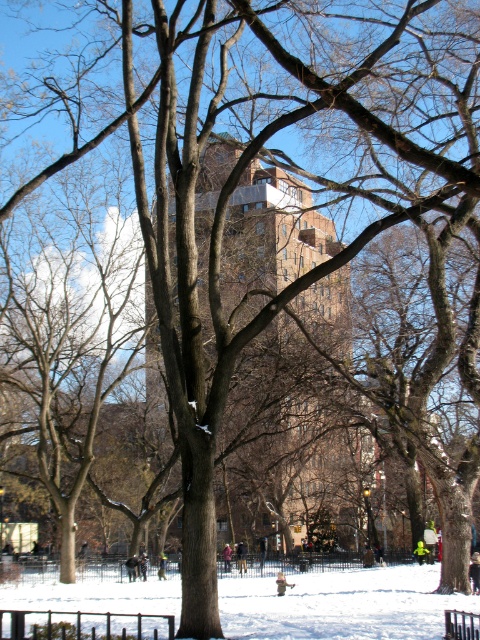
Question: Does brown brick building at center appear over black metal bench at center?

Choices:
 (A) yes
 (B) no

Answer: (A)

Question: Can you confirm if brown brick building at center is positioned above black metal bench at center?

Choices:
 (A) yes
 (B) no

Answer: (A)

Question: Which point is closer to the camera?

Choices:
 (A) (276, 228)
 (B) (421, 637)

Answer: (B)

Question: Which point is farther to the camera?

Choices:
 (A) tap(288, 257)
 (B) tap(455, 621)

Answer: (A)

Question: Is brown brick building at center above white powdery snow at center?

Choices:
 (A) yes
 (B) no

Answer: (A)

Question: Which of the following is the farthest from the observer?

Choices:
 (A) black metal bench at center
 (B) white powdery snow at center

Answer: (B)